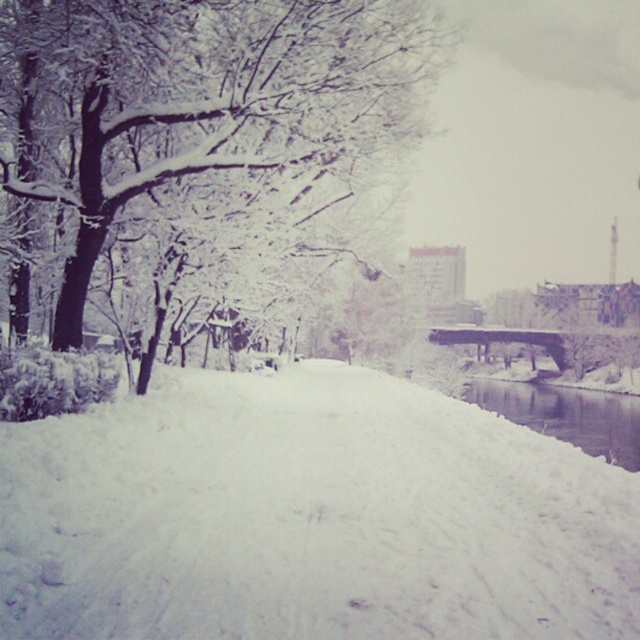
Question: Is white fluffy snow at center bigger than clear water at lower right?

Choices:
 (A) no
 (B) yes

Answer: (A)

Question: Which is farther from the clear water at lower right?

Choices:
 (A) white fluffy snow at center
 (B) snow-covered branches at upper left

Answer: (A)

Question: Is the position of snow-covered branches at upper left more distant than that of clear water at lower right?

Choices:
 (A) no
 (B) yes

Answer: (A)

Question: Which object appears farthest from the camera in this image?

Choices:
 (A) clear water at lower right
 (B) white fluffy snow at center

Answer: (A)

Question: Based on their relative distances, which object is nearer to the white fluffy snow at center?

Choices:
 (A) clear water at lower right
 (B) snow-covered branches at upper left

Answer: (B)

Question: In this image, where is white fluffy snow at center located relative to snow-covered branches at upper left?

Choices:
 (A) below
 (B) above

Answer: (A)